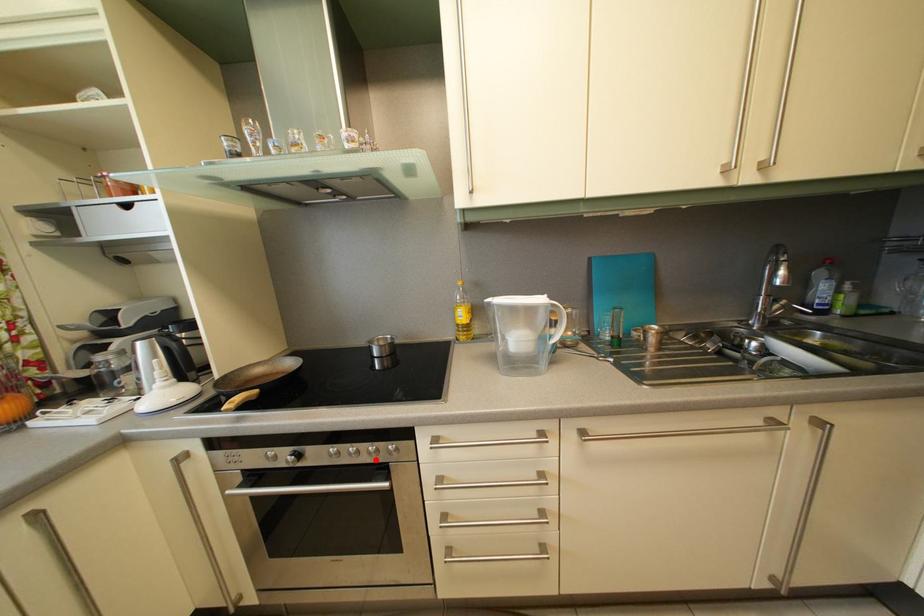
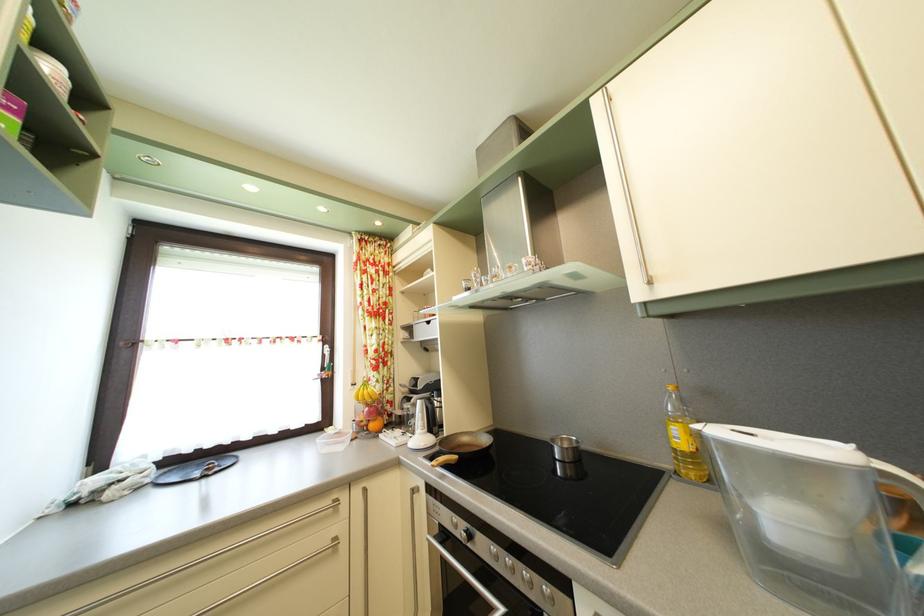
Question: I am providing you with two images of the same scene from different viewpoints. In image1, a red point is highlighted. Considering the same 3D point in image2, which of the following is correct?

Choices:
 (A) It is closer
 (B) It is farther

Answer: (A)